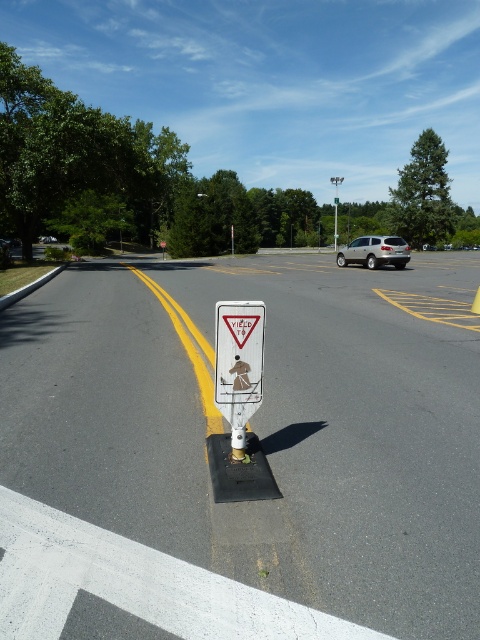
Question: Which of the following is the farthest from the observer?

Choices:
 (A) white plastic sign at center
 (B) satin gold suv at center-right

Answer: (A)

Question: Does satin gold suv at center-right appear on the right side of white plastic sign at center?

Choices:
 (A) no
 (B) yes

Answer: (A)

Question: Considering the relative positions of satin gold suv at center-right and white plastic sign at center in the image provided, where is satin gold suv at center-right located with respect to white plastic sign at center?

Choices:
 (A) below
 (B) above

Answer: (A)

Question: Is satin gold suv at center-right behind white plastic sign at center?

Choices:
 (A) yes
 (B) no

Answer: (B)

Question: Among these points, which one is nearest to the camera?

Choices:
 (A) (371, 236)
 (B) (334, 216)

Answer: (A)